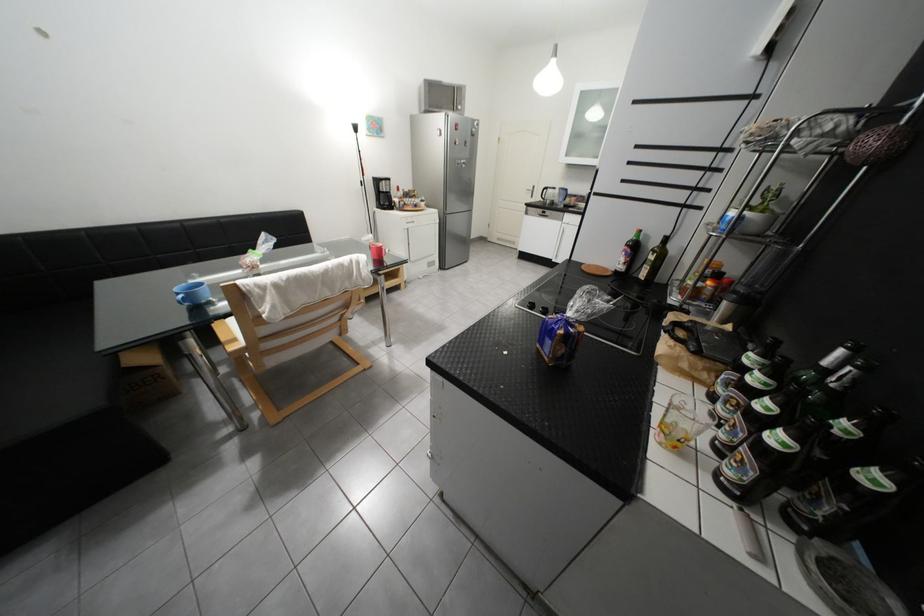
The image size is (924, 616). In order to click on blender pitcher handle in this screenshot , I will do `click(564, 197)`.